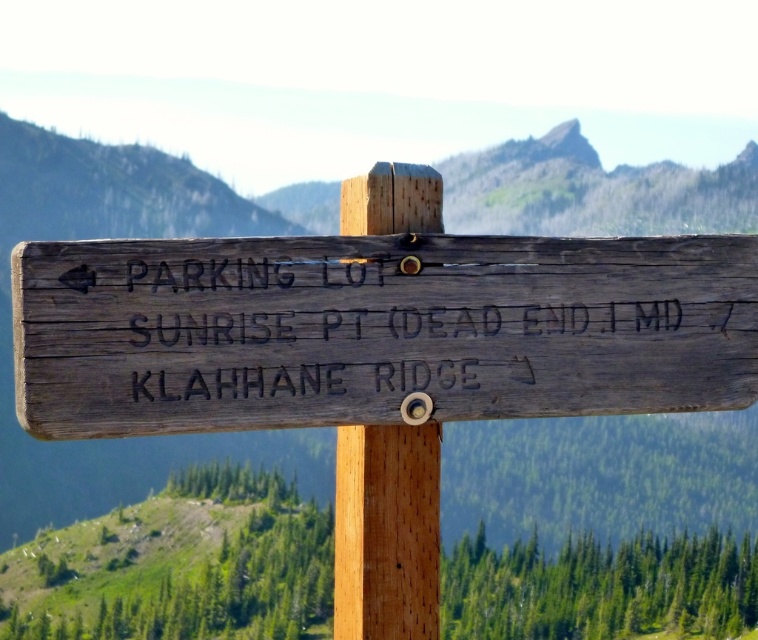
You are a hiker trying to decide whether to take a photo of the weathered wood sign at center and the smooth gray rock at upper center. Since you want both objects to be clearly visible in the photo, which one should you focus on to ensure both are in frame?

The weathered wood sign at center is larger in size than the smooth gray rock at upper center, so focusing on the weathered wood sign at center will ensure both objects are in frame as it takes up more space and the smaller rock can be included alongside it.

You are standing at the base of the mountain and see the weathered wood sign at center. According to the coordinates provided, is the sign positioned near the center of the image?

The weathered wood sign at center is located at point (376, 330), which is very close to the center coordinates of (379, 320). Therefore, the sign is positioned near the center of the image.

You are standing in front of the weathered wood sign at center and the wooden post at center. Which one is shorter?

The weathered wood sign at center is shorter than the wooden post at center.